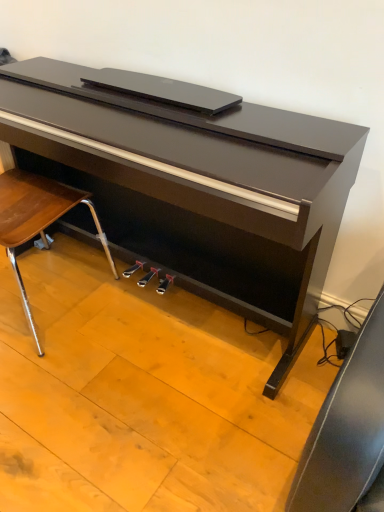
The image size is (384, 512). In order to click on vacant space in front of wooden/matte chair at lower left in this screenshot , I will do `click(60, 402)`.